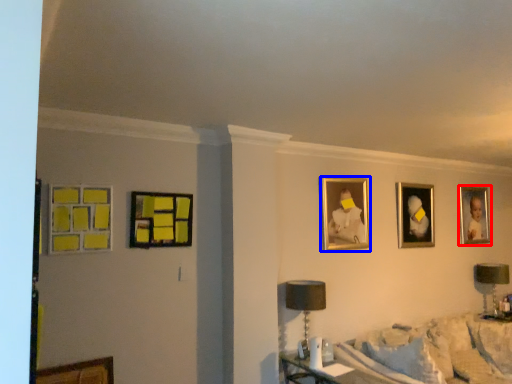
Question: Which object is further to the camera taking this photo, picture frame (highlighted by a red box) or picture frame (highlighted by a blue box)?

Choices:
 (A) picture frame
 (B) picture frame

Answer: (A)